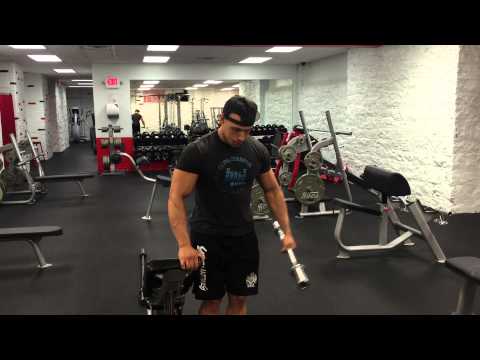
You are a GUI agent. You are given a task and a screenshot of the screen. Output one action in this format:
    pyautogui.click(x=<x>, y=<y>)
    Task: Click on the black floor
    
    Given the screenshot: What is the action you would take?
    pyautogui.click(x=129, y=249)